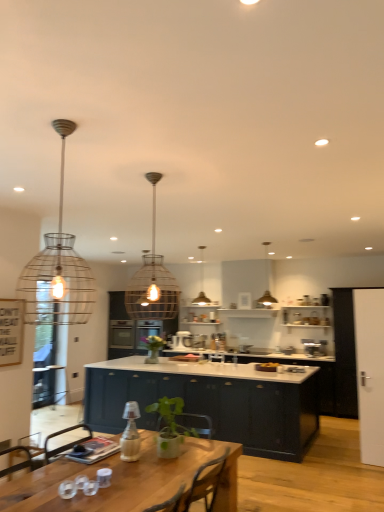
Question: Which direction should I rotate to face satin silver mixer at center, acting as the 2th appliance starting from the right, — up or down?

Choices:
 (A) down
 (B) up

Answer: (A)

Question: Is satin silver toaster at center, which appears as the 1th appliance when viewed from the front, aimed at wire mesh pendant light at upper left, the 1th lamp in the front-to-back sequence?

Choices:
 (A) no
 (B) yes

Answer: (B)

Question: From a real-world perspective, is satin silver toaster at center, which appears as the 1th appliance when viewed from the front, over wire mesh pendant light at upper left, the fourth lamp from the back?

Choices:
 (A) yes
 (B) no

Answer: (B)

Question: Does satin silver toaster at center, the first appliance in the right-to-left sequence, touch wire mesh pendant light at upper left, the fourth lamp from the back?

Choices:
 (A) no
 (B) yes

Answer: (A)

Question: From the image's perspective, would you say satin silver toaster at center, which appears as the 1th appliance when viewed from the front, is shown under wire mesh pendant light at upper left, the 1th lamp in the front-to-back sequence?

Choices:
 (A) yes
 (B) no

Answer: (A)

Question: Is satin silver toaster at center, the 2th appliance viewed from the back, bigger than wire mesh pendant light at upper left, which appears as the 1th lamp when viewed from the left?

Choices:
 (A) yes
 (B) no

Answer: (B)

Question: Is satin silver toaster at center, which is the second appliance in left-to-right order, to the left of wire mesh pendant light at upper left, which appears as the 1th lamp when viewed from the left, from the viewer's perspective?

Choices:
 (A) no
 (B) yes

Answer: (A)

Question: Would you say glossy dark blue cabinet at center, which appears as the first cabinetry when viewed from the front, contains white glossy door at right?

Choices:
 (A) no
 (B) yes

Answer: (A)

Question: Could you tell me if glossy dark blue cabinet at center, which appears as the second cabinetry when viewed from the back, is turned towards white glossy door at right?

Choices:
 (A) yes
 (B) no

Answer: (B)

Question: From the image's perspective, is glossy dark blue cabinet at center, which appears as the second cabinetry when viewed from the back, beneath white glossy door at right?

Choices:
 (A) no
 (B) yes

Answer: (B)

Question: Is glossy dark blue cabinet at center, which appears as the second cabinetry when viewed from the back, behind white glossy door at right?

Choices:
 (A) yes
 (B) no

Answer: (A)

Question: Is glossy dark blue cabinet at center, which appears as the first cabinetry when viewed from the front, positioned far away from white glossy door at right?

Choices:
 (A) yes
 (B) no

Answer: (A)

Question: Does glossy dark blue cabinet at center, which appears as the second cabinetry when viewed from the back, appear on the right side of white glossy door at right?

Choices:
 (A) yes
 (B) no

Answer: (B)

Question: From the image's perspective, is satin silver toaster at center, which is the second appliance in left-to-right order, beneath glossy dark blue cabinet at center, which appears as the second cabinetry when viewed from the back?

Choices:
 (A) yes
 (B) no

Answer: (B)